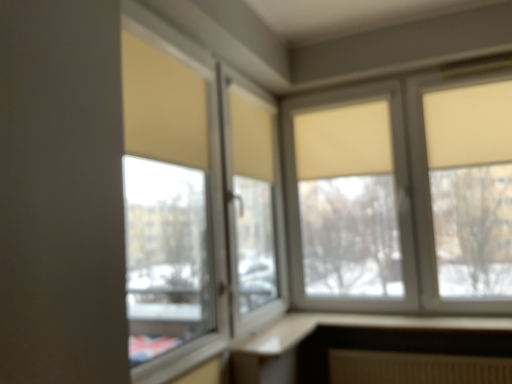
Question: Considering the positions of matte glass window at center, which is the second window from back to front, and matte beige roller blinds at upper right, which is counted as the second window, starting from the left, in the image, is matte glass window at center, which is the second window from back to front, bigger or smaller than matte beige roller blinds at upper right, which is counted as the second window, starting from the left,?

Choices:
 (A) big
 (B) small

Answer: (B)

Question: Considering the relative positions of matte glass window at center, which is the second window from back to front, and matte beige roller blinds at upper right, which is counted as the 2th window, starting from the front, in the image provided, is matte glass window at center, which is the second window from back to front, to the left or to the right of matte beige roller blinds at upper right, which is counted as the 2th window, starting from the front,?

Choices:
 (A) right
 (B) left

Answer: (B)

Question: Based on their relative distances, which object is nearer to the matte glass window at center, the 2th window from the right?

Choices:
 (A) beige fabric curtain at center
 (B) matte beige roller blinds at upper right, which is counted as the second window, starting from the left

Answer: (A)

Question: Estimate the real-world distances between objects in this image. Which object is farther from the matte glass window at center, the 2th window from the right?

Choices:
 (A) matte beige roller blinds at upper right, which is counted as the second window, starting from the left
 (B) beige fabric curtain at center

Answer: (A)